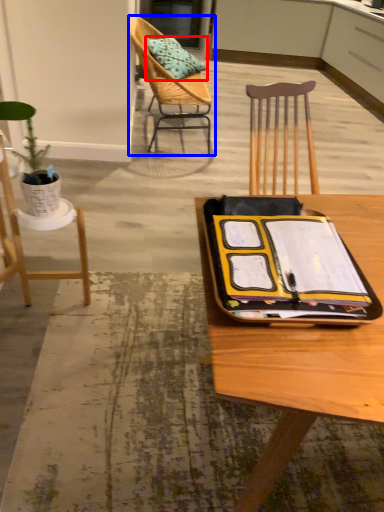
Question: Which object is further to the camera taking this photo, pillow (highlighted by a red box) or chair (highlighted by a blue box)?

Choices:
 (A) pillow
 (B) chair

Answer: (A)